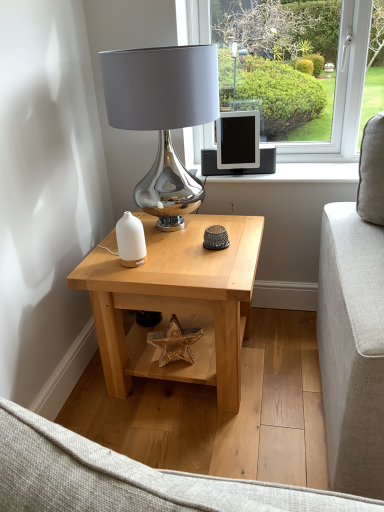
Question: Would you say shiny metallic lamp at center is to the left or to the right of white glossy candle holder at center in the picture?

Choices:
 (A) left
 (B) right

Answer: (B)

Question: Looking at their shapes, would you say shiny metallic lamp at center is wider or thinner than white glossy candle holder at center?

Choices:
 (A) thin
 (B) wide

Answer: (B)

Question: Estimate the real-world distances between objects in this image. Which object is closer to the shiny metallic lamp at center?

Choices:
 (A) natural wood table at center
 (B) matte black tablet at center
 (C) white glossy candle holder at center

Answer: (C)

Question: Which object is positioned closest to the matte black tablet at center?

Choices:
 (A) shiny metallic lamp at center
 (B) white glossy candle holder at center
 (C) natural wood table at center

Answer: (A)